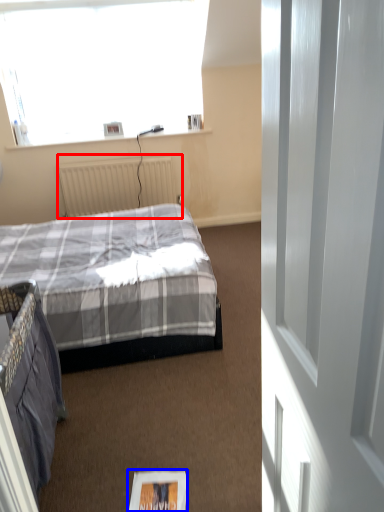
Question: Which of the following is the farthest to the observer, radiator (highlighted by a red box) or magazine (highlighted by a blue box)?

Choices:
 (A) radiator
 (B) magazine

Answer: (A)